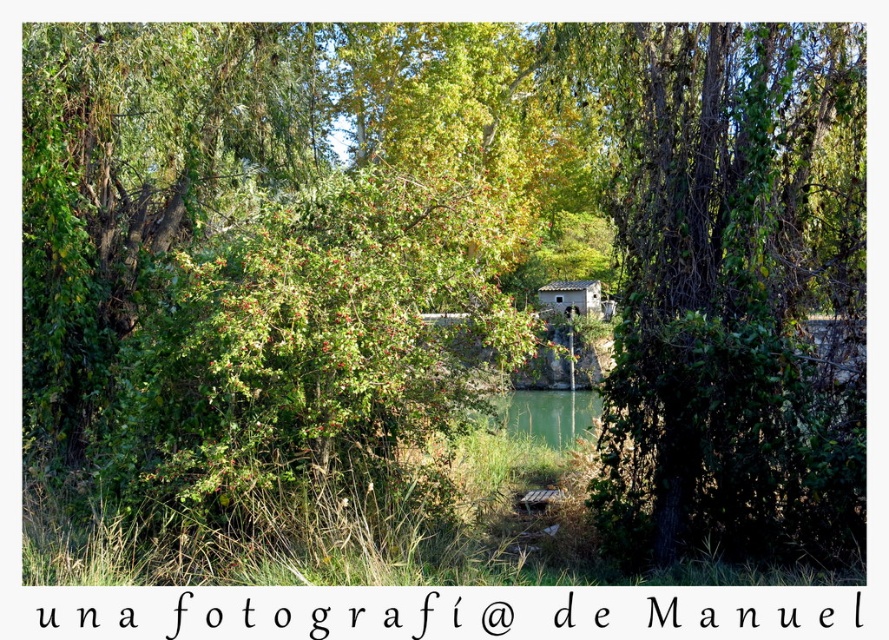
You are planning to take a photo of the rustic stone hut at center and the green leafy tree at center. Which object should you focus on first if you want to capture both in the frame without moving the camera?

You should focus on the green leafy tree at center first because it is larger in size than the rustic stone hut at center, so it will occupy more space in the frame.

You are standing in the serene natural scene described. You need to locate the green leafy tree at center. Based on its coordinates, which direction should you face to see it clearly?

The green leafy tree at center is located at coordinates point (x=737, y=294), which means it is positioned slightly to the right and lower center of the scene. To see it clearly, you should face towards the lower center area, slightly to the right.